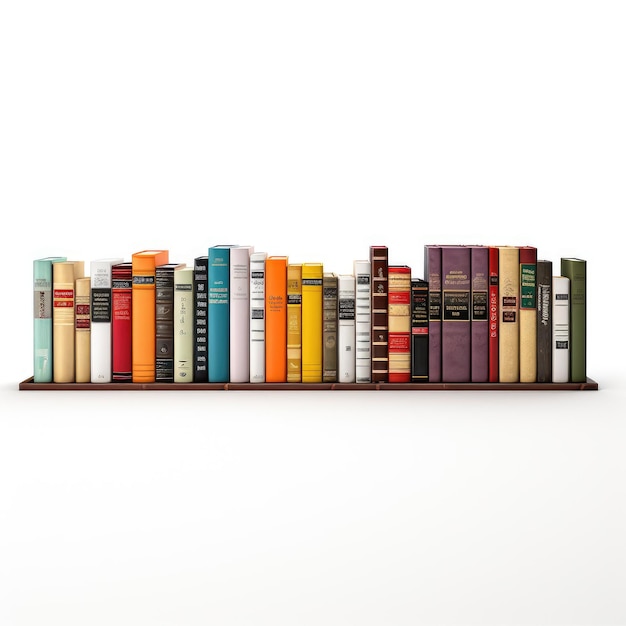
You are a GUI agent. You are given a task and a screenshot of the screen. Output one action in this format:
    pyautogui.click(x=<x>, y=<y>)
    Task: Click on the first ten books on the left side of the shelf
    The height and width of the screenshot is (626, 626).
    Given the screenshot: What is the action you would take?
    pos(39,340), pos(62,337), pos(83,339), pos(101,340), pos(121,336), pos(148,335), pos(165,335), pos(182,335), pos(200,331), pos(213,326)